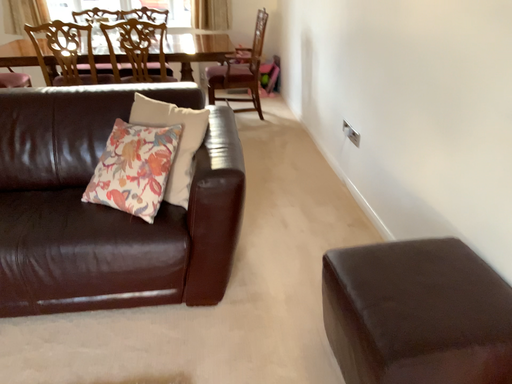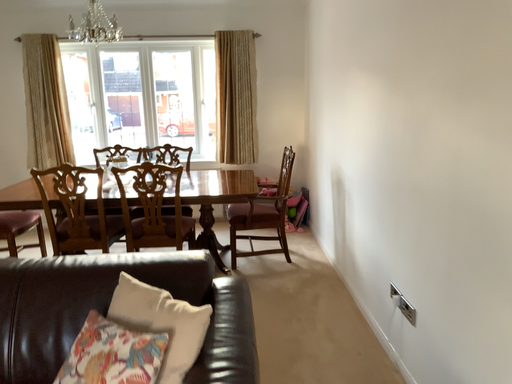
Question: Which way did the camera rotate in the video?

Choices:
 (A) rotated downward
 (B) rotated upward

Answer: (B)